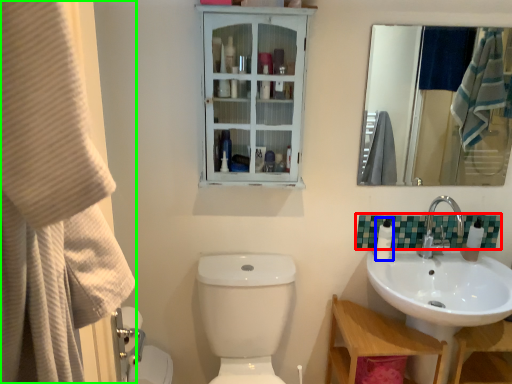
Question: Considering the real-world distances, which object is farthest from tile (highlighted by a red box)? toiletry (highlighted by a blue box) or shower curtain (highlighted by a green box)?

Choices:
 (A) toiletry
 (B) shower curtain

Answer: (B)